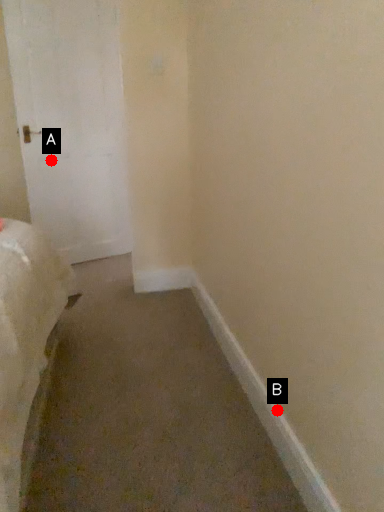
Question: Two points are circled on the image, labeled by A and B beside each circle. Which point appears closest to the camera in this image?

Choices:
 (A) A is closer
 (B) B is closer

Answer: (B)